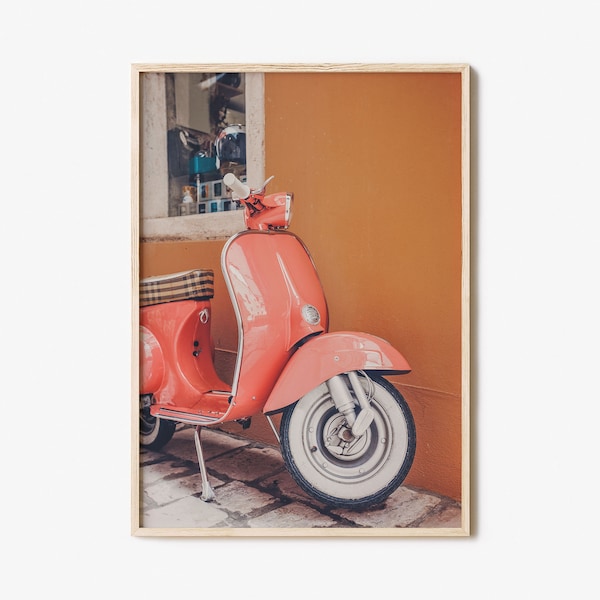
This screenshot has height=600, width=600. In order to click on orange wall in this screenshot , I will do `click(388, 313)`.